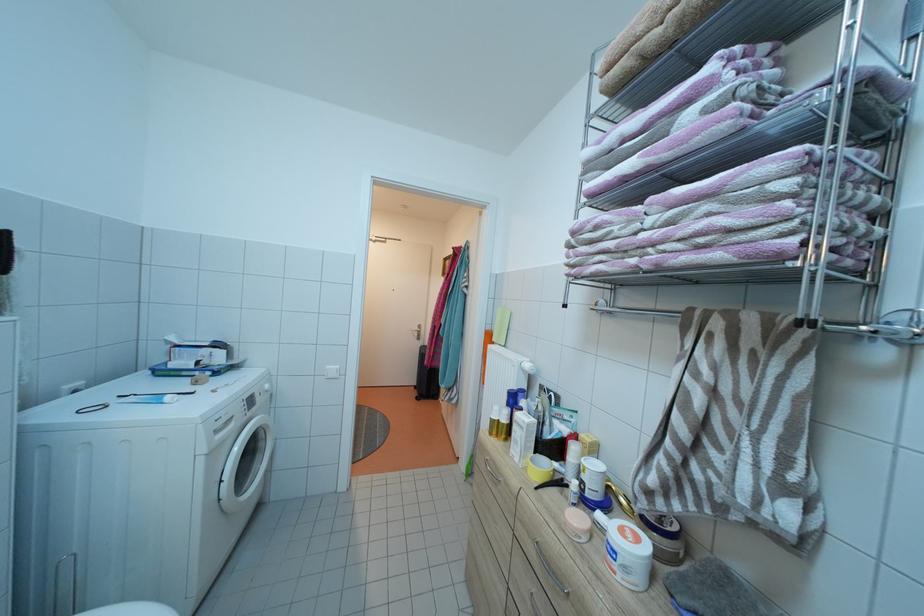
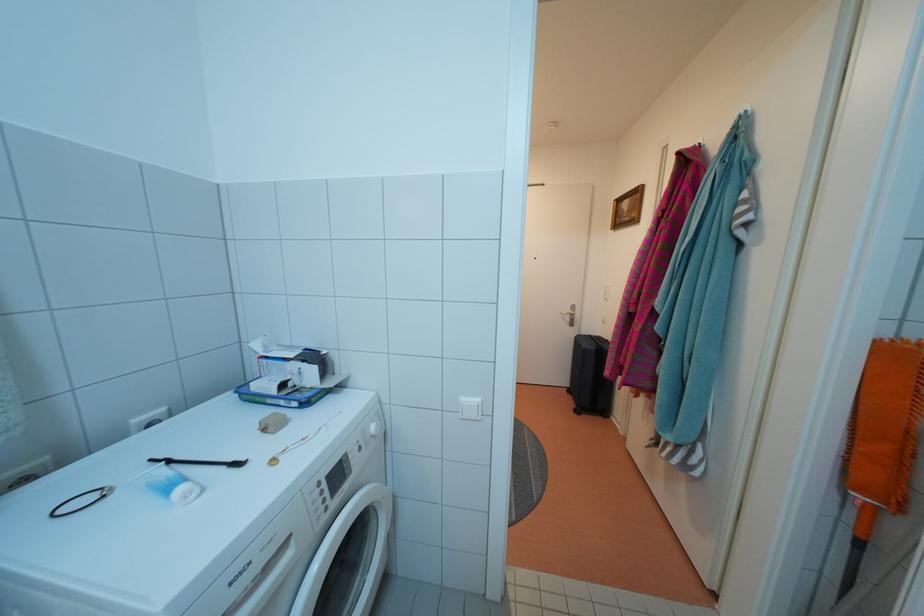
The point at (341, 374) is marked in the first image. Where is the corresponding point in the second image?

(478, 408)